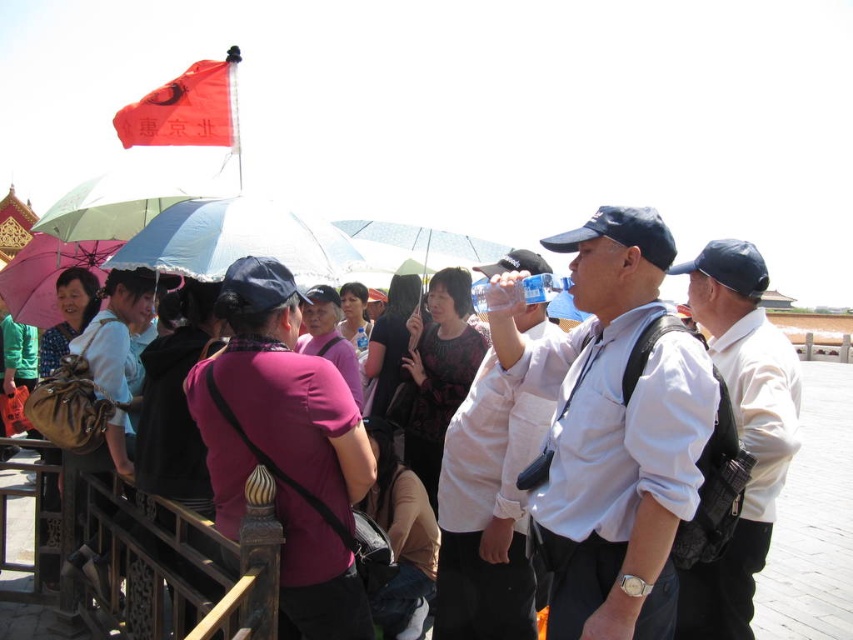
Question: Is purple matte shirt at center closer to camera compared to pink fabric shirt at center?

Choices:
 (A) no
 (B) yes

Answer: (B)

Question: Which point appears farthest from the camera in this image?

Choices:
 (A) (467, 358)
 (B) (39, 284)
 (C) (379, 365)

Answer: (C)

Question: Which point appears closest to the camera in this image?

Choices:
 (A) (273, 589)
 (B) (393, 301)
 (C) (294, 260)
 (D) (305, 312)

Answer: (A)

Question: Is printed fabric shirt at center to the left of pink fabric shirt at center from the viewer's perspective?

Choices:
 (A) no
 (B) yes

Answer: (A)

Question: Is white matte shirt at center to the right of pink fabric shirt at center from the viewer's perspective?

Choices:
 (A) no
 (B) yes

Answer: (B)

Question: Considering the real-world distances, which object is closest to the brown leather bag at center?

Choices:
 (A) brown wood railing at lower left
 (B) green matte umbrella at upper left
 (C) transparent plastic umbrella at center

Answer: (A)